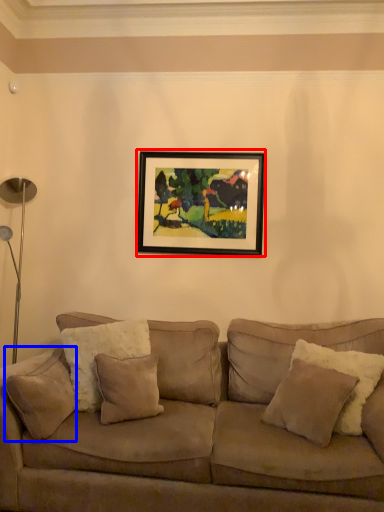
Question: Which of the following is the closest to the observer, picture frame (highlighted by a red box) or pillow (highlighted by a blue box)?

Choices:
 (A) picture frame
 (B) pillow

Answer: (B)